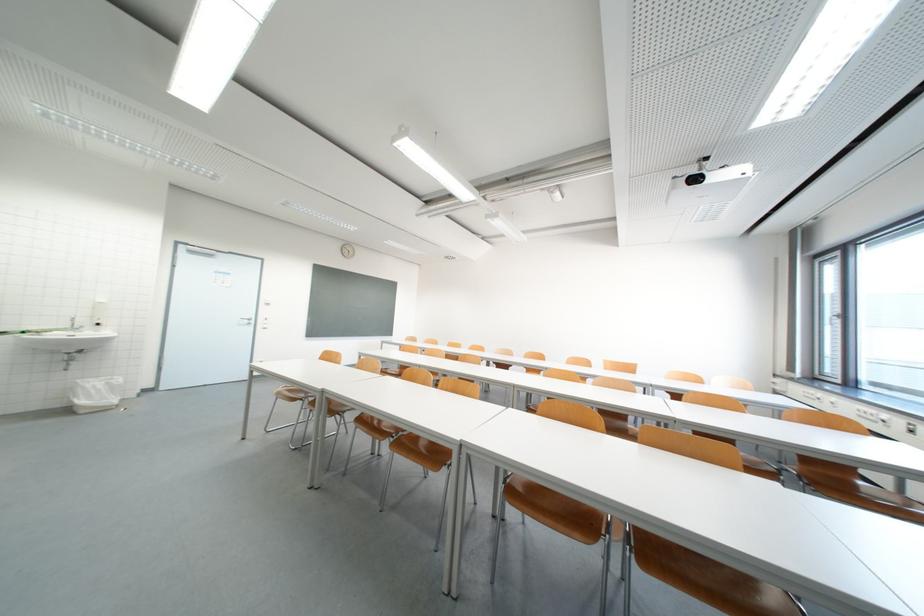
What do you see at coordinates (835, 317) in the screenshot? I see `the window handle` at bounding box center [835, 317].